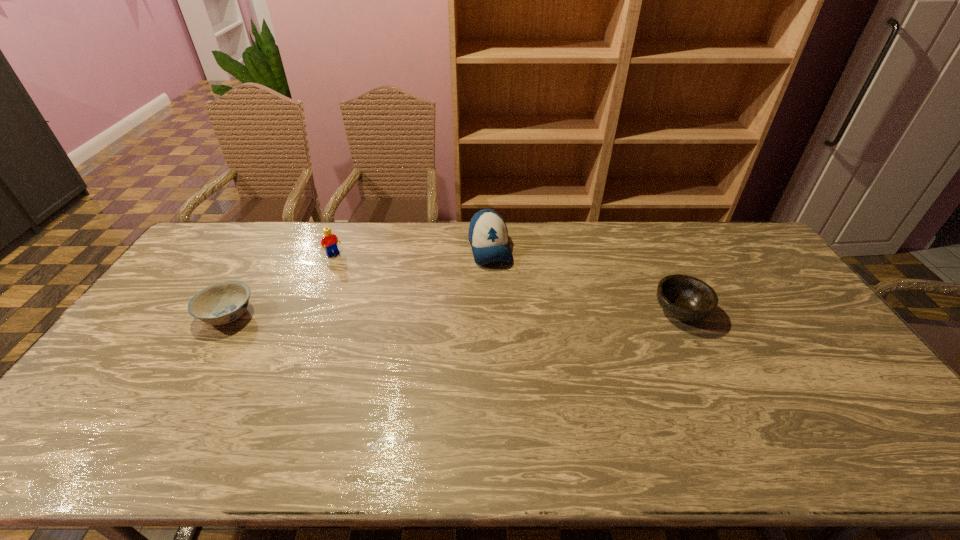
Identify the location of free space located on the front-facing side of the third object from left to right. This screenshot has height=540, width=960. (502, 292).

I want to click on vacant space located 0.050m on the front-facing side of the third object from left to right, so (498, 279).

This screenshot has height=540, width=960. Identify the location of Lego that is at the far edge. (330, 240).

Identify the location of baseball cap located at the far edge. Image resolution: width=960 pixels, height=540 pixels. (488, 235).

You are a GUI agent. You are given a task and a screenshot of the screen. Output one action in this format:
    pyautogui.click(x=<x>, y=<y>)
    Task: Click on the vacant space at the far edge of the desktop
    The width and height of the screenshot is (960, 540).
    Given the screenshot: What is the action you would take?
    pyautogui.click(x=352, y=221)

In the image, there is a desktop. Identify the location of free space at the near edge. (326, 400).

The width and height of the screenshot is (960, 540). In the image, there is a desktop. In order to click on vacant region at the left edge in this screenshot , I will do `click(174, 316)`.

Where is `vacant space at the right edge`? Image resolution: width=960 pixels, height=540 pixels. vacant space at the right edge is located at coordinates (814, 384).

Identify the location of free space at the far right corner. The image size is (960, 540). (756, 256).

The width and height of the screenshot is (960, 540). In order to click on free space at the near right corner in this screenshot , I will do `click(889, 423)`.